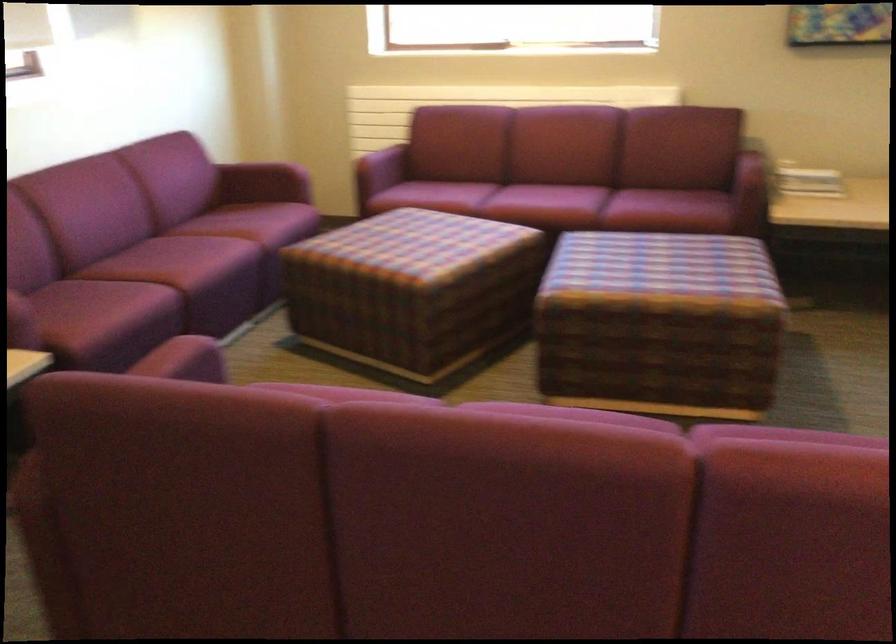
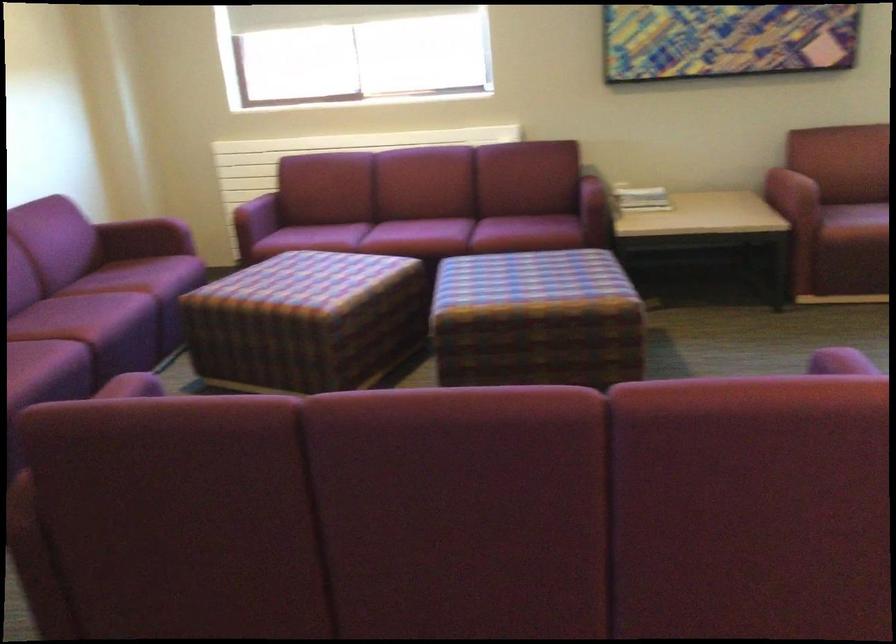
In a continuous first-person perspective shot, in which direction is the camera moving?

The cameraman moved toward left, backward.